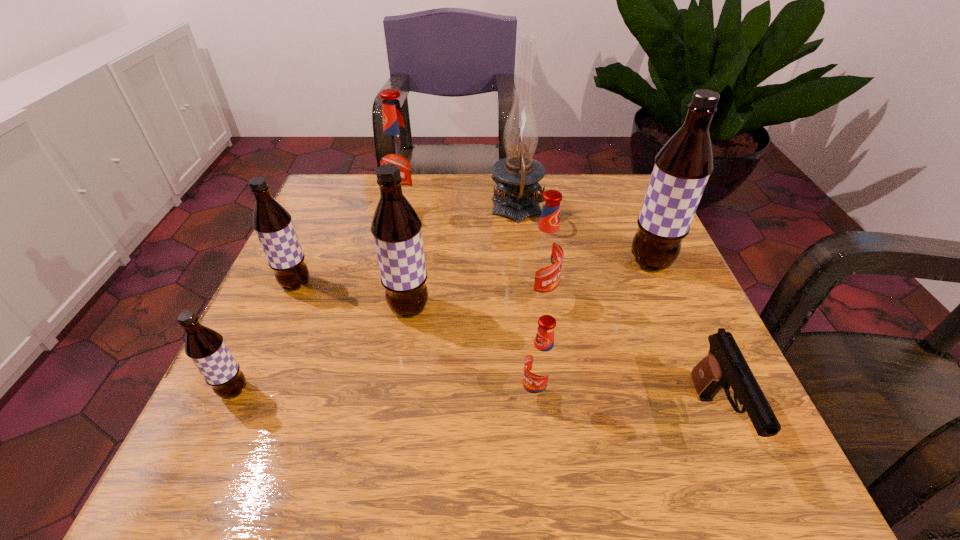
I want to click on oil lamp, so click(x=516, y=197).

At what (x,y) coordinates should I click in order to perform the action: click on the biggest brown root beer. Please return your answer as a coordinate pair (x, y). The width and height of the screenshot is (960, 540). Looking at the image, I should click on (682, 167).

I want to click on the rightmost root beer, so [682, 167].

Locate an element on the screen. Image resolution: width=960 pixels, height=540 pixels. the biggest red root beer is located at coordinates (396, 149).

At what (x,y) coordinates should I click in order to perform the action: click on the farthest red root beer. Please return your answer as a coordinate pair (x, y). Looking at the image, I should click on (396, 149).

The image size is (960, 540). Find the location of `the third smallest brown root beer`. the third smallest brown root beer is located at coordinates (396, 227).

Locate an element on the screen. This screenshot has width=960, height=540. the third biggest brown root beer is located at coordinates (273, 224).

Identify the location of the second smallest red root beer. The width and height of the screenshot is (960, 540). (545, 251).

In order to click on the smallest brown root beer in this screenshot , I will do `click(206, 348)`.

Image resolution: width=960 pixels, height=540 pixels. Find the location of `the smallest red root beer`. the smallest red root beer is located at coordinates (x=541, y=361).